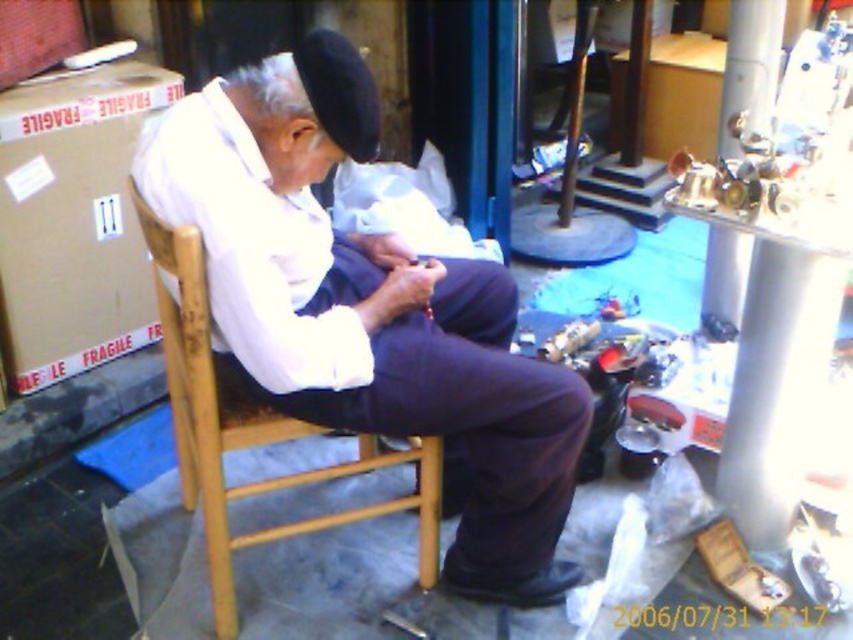
Between brown cardboard box at left and navy felt hat at upper center, which one is positioned higher?

navy felt hat at upper center is above.

This screenshot has height=640, width=853. What are the coordinates of `brown cardboard box at left` in the screenshot? It's located at [x=74, y=220].

Where is `brown cardboard box at left`? Image resolution: width=853 pixels, height=640 pixels. brown cardboard box at left is located at coordinates (74, 220).

Can you confirm if brown cardboard box at left is positioned below metallic silver pole at right?

Yes.

Does brown cardboard box at left have a larger size compared to metallic silver pole at right?

Yes.

Which is behind, point (27, 225) or point (759, 52)?

The point (759, 52) is behind.

What are the coordinates of `brown cardboard box at left` in the screenshot? It's located at (74, 220).

Does point (712, 328) lie in front of point (347, 138)?

No, (712, 328) is behind (347, 138).

This screenshot has width=853, height=640. Describe the element at coordinates (749, 65) in the screenshot. I see `metallic silver pole at right` at that location.

Locate an element on the screen. The width and height of the screenshot is (853, 640). metallic silver pole at right is located at coordinates (749, 65).